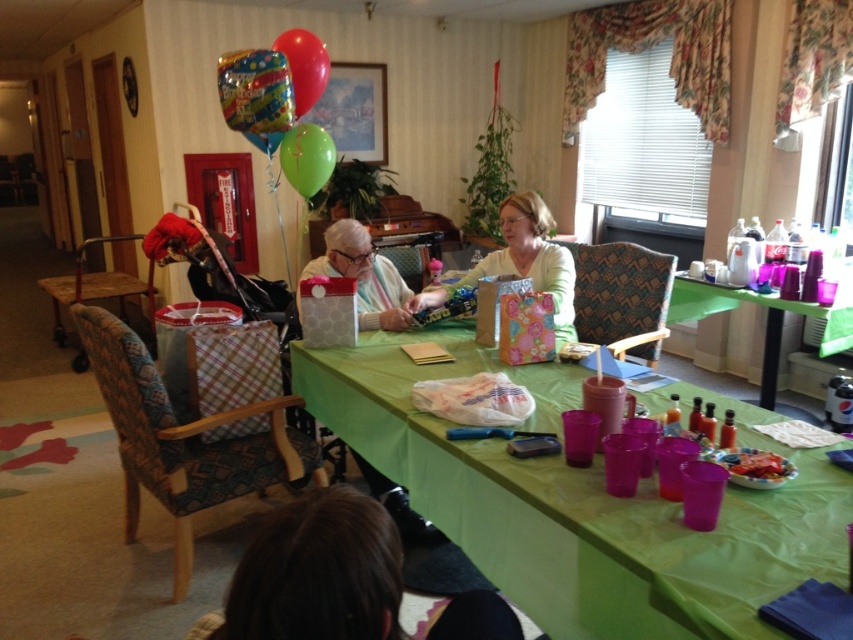
Question: Is green fabric table at center further to the viewer compared to matte white shirt at center?

Choices:
 (A) yes
 (B) no

Answer: (B)

Question: Does white paper bag at center appear on the left side of matte white shirt at center?

Choices:
 (A) no
 (B) yes

Answer: (B)

Question: Among these points, which one is farthest from the camera?

Choices:
 (A) (404, 328)
 (B) (669, 300)
 (C) (285, 164)
 (D) (540, 224)

Answer: (C)

Question: Which of the following is the closest to the observer?

Choices:
 (A) (635, 541)
 (B) (772, 326)
 (C) (303, 275)
 (D) (292, 120)

Answer: (A)

Question: Is matte white shirt at center thinner than green rubber balloon at upper center?

Choices:
 (A) no
 (B) yes

Answer: (A)

Question: Which point is farther from the camera taking this photo?

Choices:
 (A) (546, 244)
 (B) (355, 221)
 (C) (291, 152)
 (D) (267, 108)

Answer: (C)